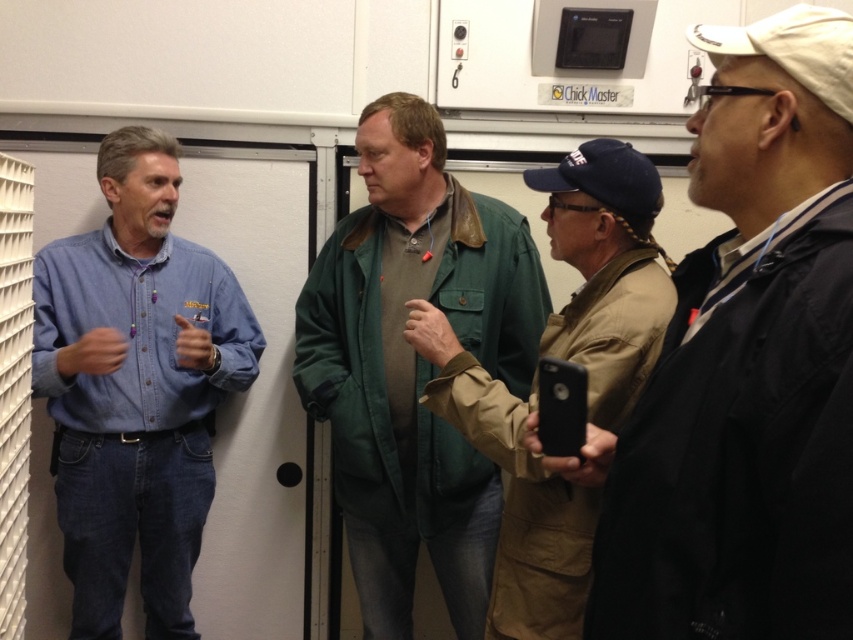
Question: Does black matte jacket at right have a smaller size compared to green leather jacket at center?

Choices:
 (A) yes
 (B) no

Answer: (A)

Question: Which point is closer to the camera taking this photo?

Choices:
 (A) (421, 284)
 (B) (770, 412)
 (C) (566, 596)

Answer: (B)

Question: Estimate the real-world distances between objects in this image. Which object is farther from the denim shirt at left?

Choices:
 (A) tan fabric jacket at center
 (B) green leather jacket at center

Answer: (A)

Question: Which of the following is the farthest from the observer?

Choices:
 (A) green leather jacket at center
 (B) black matte jacket at right
 (C) tan fabric jacket at center

Answer: (A)

Question: Where is denim shirt at left located in relation to tan fabric jacket at center in the image?

Choices:
 (A) above
 (B) below

Answer: (B)

Question: Can you confirm if denim shirt at left is thinner than tan fabric jacket at center?

Choices:
 (A) no
 (B) yes

Answer: (A)